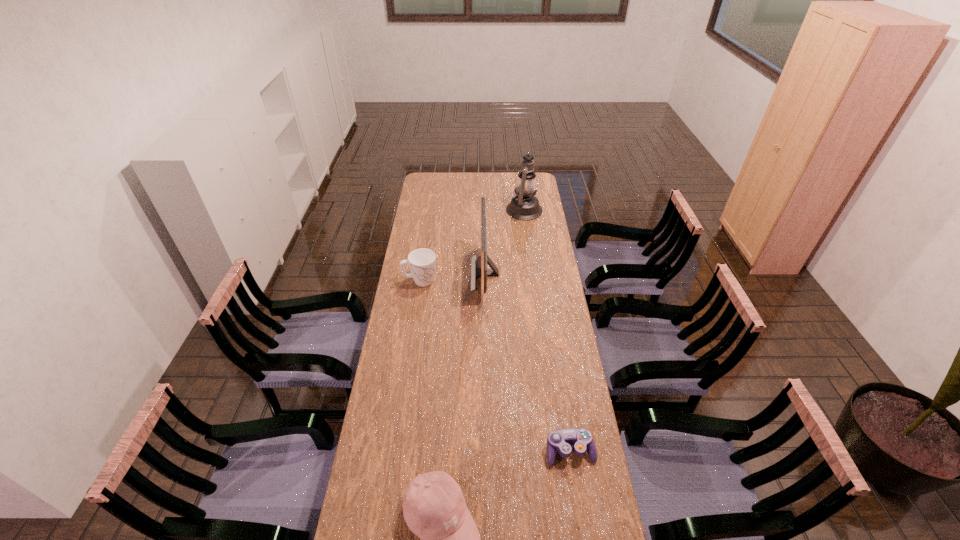
At what (x,y) coordinates should I click in order to perform the action: click on free space that is in between the control and the tallest object. Please return your answer as a coordinate pair (x, y). The image size is (960, 540). Looking at the image, I should click on (545, 330).

Locate an element on the screen. The height and width of the screenshot is (540, 960). vacant area that lies between the control and the farthest object is located at coordinates (545, 330).

Image resolution: width=960 pixels, height=540 pixels. Find the location of `unoccupied position between the farthest object and the control`. unoccupied position between the farthest object and the control is located at coordinates (545, 330).

The image size is (960, 540). Find the location of `vacant area that lies between the farthest object and the control`. vacant area that lies between the farthest object and the control is located at coordinates (545, 330).

At what (x,y) coordinates should I click in order to perform the action: click on free spot between the farthest object and the mug. Please return your answer as a coordinate pair (x, y). Looking at the image, I should click on (470, 245).

At what (x,y) coordinates should I click in order to perform the action: click on object that stands as the fourth closest to the tallest object. Please return your answer as a coordinate pair (x, y). The height and width of the screenshot is (540, 960). Looking at the image, I should click on (434, 508).

You are a GUI agent. You are given a task and a screenshot of the screen. Output one action in this format:
    pyautogui.click(x=<x>, y=<y>)
    Task: Click on the fourth closest object to the mug
    The image size is (960, 540).
    Given the screenshot: What is the action you would take?
    tap(434, 508)

Locate an element on the screen. free space that satisfies the following two spatial constraints: 1. on the side of the mug with the handle; 2. on the right side of the control is located at coordinates (395, 451).

I want to click on vacant region that satisfies the following two spatial constraints: 1. on the screen side of the second tallest object; 2. on the right side of the second nearest object, so click(x=488, y=451).

This screenshot has width=960, height=540. I want to click on vacant space that satisfies the following two spatial constraints: 1. on the screen side of the fourth shortest object; 2. on the right side of the second nearest object, so click(x=488, y=451).